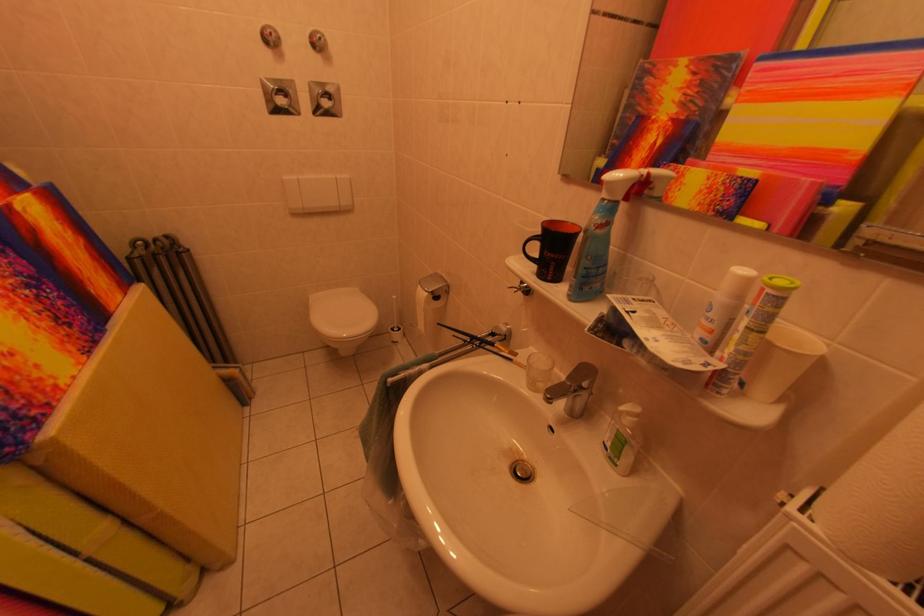
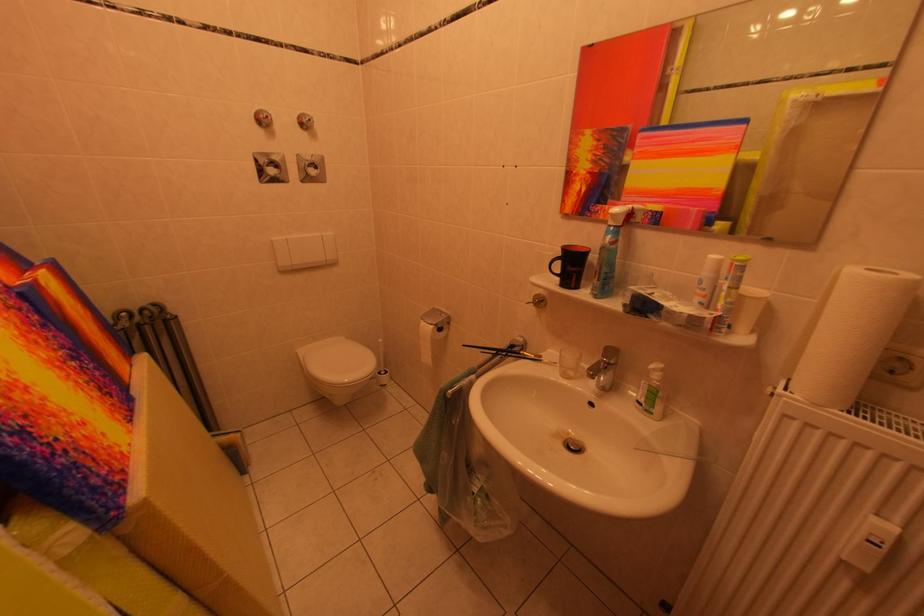
The point at (525, 294) is marked in the first image. Where is the corresponding point in the second image?

(541, 308)